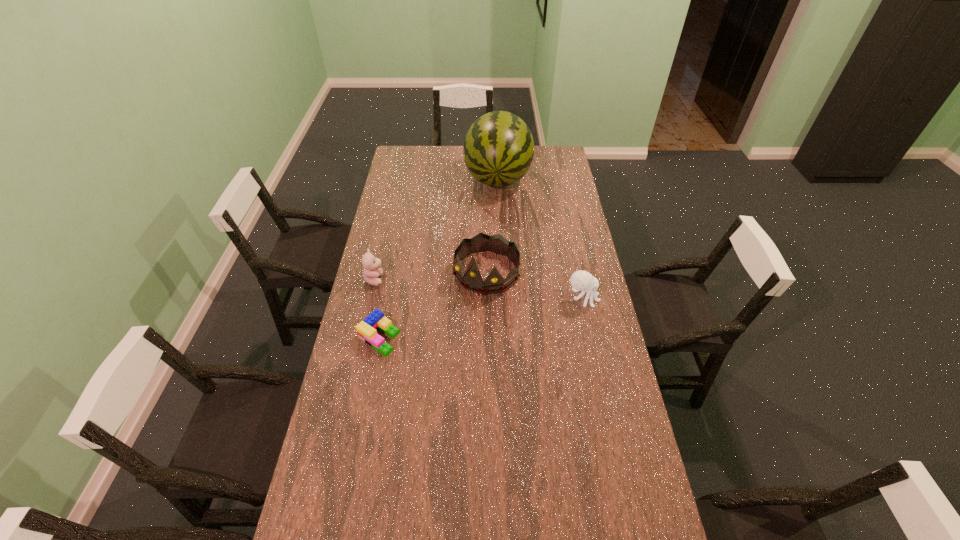
The image size is (960, 540). I want to click on free space located at the stem end of the farthest object, so click(494, 213).

At what (x,y) coordinates should I click in order to perform the action: click on free spot located 0.120m at the front of the second tallest object with jewels. Please return your answer as a coordinate pair (x, y). The image size is (960, 540). Looking at the image, I should click on (458, 317).

You are a GUI agent. You are given a task and a screenshot of the screen. Output one action in this format:
    pyautogui.click(x=<x>, y=<y>)
    Task: Click on the vacant space located at the front of the second tallest object with jewels
    
    Given the screenshot: What is the action you would take?
    pos(467,304)

This screenshot has height=540, width=960. Identify the location of vacant area situated at the front of the second tallest object with jewels. (445, 337).

Image resolution: width=960 pixels, height=540 pixels. I want to click on free spot located 0.140m at the face of the teddy bear, so click(417, 290).

This screenshot has width=960, height=540. I want to click on vacant space located at the face of the teddy bear, so 480,305.

At what (x,y) coordinates should I click in order to perform the action: click on vacant space located 0.270m at the face of the teddy bear. Please return your answer as a coordinate pair (x, y). The height and width of the screenshot is (540, 960). Looking at the image, I should click on (448, 298).

The image size is (960, 540). I want to click on object at the far edge, so click(x=498, y=150).

At what (x,y) coordinates should I click in order to perform the action: click on Lego that is positioned at the left edge. Please return your answer as a coordinate pair (x, y). Image resolution: width=960 pixels, height=540 pixels. Looking at the image, I should click on (367, 329).

This screenshot has width=960, height=540. Find the location of `teddy bear at the left edge`. teddy bear at the left edge is located at coordinates (371, 272).